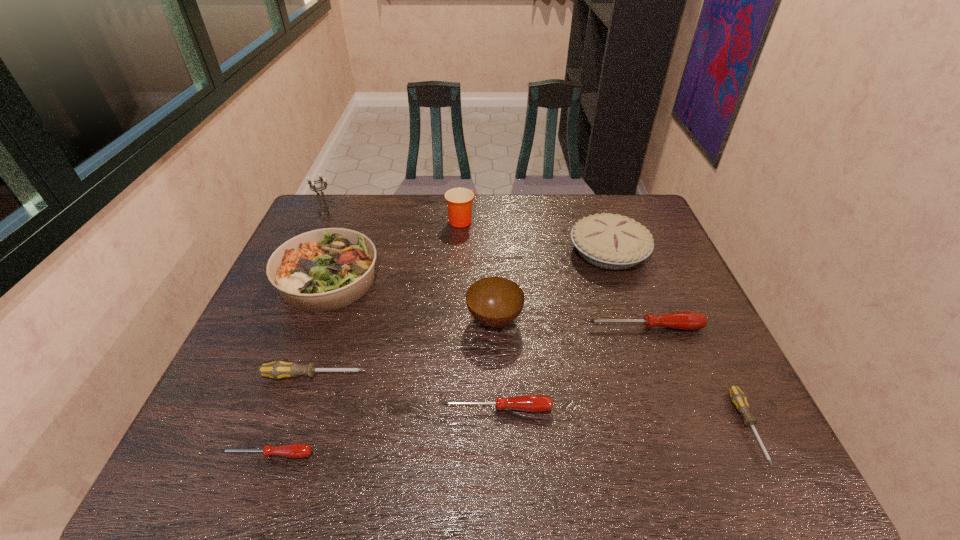
The width and height of the screenshot is (960, 540). In order to click on the second red screwdriver from right to left in this screenshot , I will do `click(530, 403)`.

Locate an element on the screen. The width and height of the screenshot is (960, 540). the nearer gray screwdriver is located at coordinates (738, 398).

Locate an element on the screen. the right gray screwdriver is located at coordinates (738, 398).

What are the coordinates of `the nearest red screwdriver` in the screenshot? It's located at (297, 450).

Find the location of `the shortest object`. the shortest object is located at coordinates (297, 450).

Locate an element on the screen. The height and width of the screenshot is (540, 960). free space located 0.330m on the right of the candle holder is located at coordinates (432, 213).

This screenshot has height=540, width=960. I want to click on free space located on the front of the ninth shortest object, so click(x=460, y=239).

At what (x,y) coordinates should I click in order to perform the action: click on vacant space located 0.220m on the left of the pie. Please return your answer as a coordinate pair (x, y). The width and height of the screenshot is (960, 540). Looking at the image, I should click on (497, 252).

Locate an element on the screen. vacant space located on the back of the salad plate is located at coordinates (345, 237).

The image size is (960, 540). In order to click on vacant area situated 0.400m on the right of the bowl in this screenshot , I will do `click(677, 319)`.